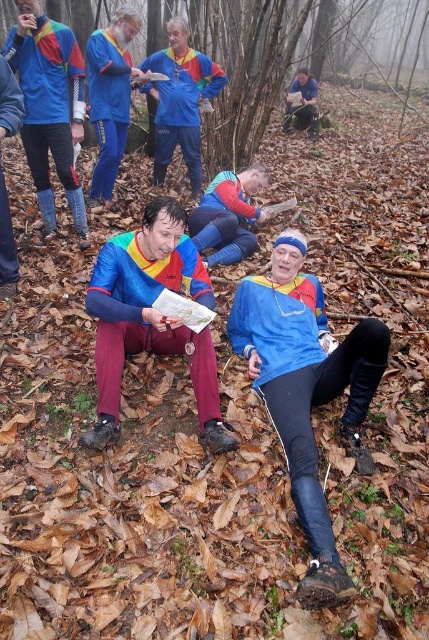
Question: Considering the relative positions of matte blue jacket at upper center and matte blue jacket at center in the image provided, where is matte blue jacket at upper center located with respect to matte blue jacket at center?

Choices:
 (A) left
 (B) right

Answer: (A)

Question: Which object appears closest to the camera in this image?

Choices:
 (A) matte blue and red tracksuit at center
 (B) matte blue jacket at upper left
 (C) matte blue jacket at upper center

Answer: (A)

Question: Which object is the closest to the matte blue jacket at upper left?

Choices:
 (A) matte blue and red tracksuit at center
 (B) matte blue jacket at upper center

Answer: (B)

Question: Which object is closer to the camera taking this photo?

Choices:
 (A) blue fabric map at center
 (B) matte blue jacket at upper left
 (C) matte blue and red tracksuit at center
 (D) matte blue jacket at upper center

Answer: (C)

Question: Does matte blue jacket at center appear on the left side of blue fabric map at center?

Choices:
 (A) no
 (B) yes

Answer: (B)

Question: Is matte blue and red tracksuit at center bigger than matte blue jacket at upper left?

Choices:
 (A) no
 (B) yes

Answer: (A)